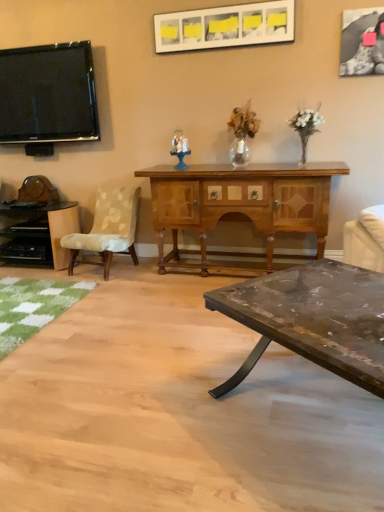
Question: Considering their positions, is rustic wood coffee table at lower right located in front of or behind translucent glass figurine at center?

Choices:
 (A) front
 (B) behind

Answer: (A)

Question: From the image's perspective, relative to translucent glass figurine at center, is rustic wood coffee table at lower right above or below?

Choices:
 (A) above
 (B) below

Answer: (B)

Question: Which is farther from the flat screen tv at upper left?

Choices:
 (A) rustic wood coffee table at lower right
 (B) wooden cabinet at center, the 2th desk viewed from the left
 (C) black glossy desk at left, the second desk in the right-to-left sequence
 (D) white fabric couch at right
 (E) beige fabric chair at left

Answer: (A)

Question: Which object is the closest to the white glossy picture frame at upper center, acting as the 1th picture frame starting from the left?

Choices:
 (A) rustic wood coffee table at lower right
 (B) flat screen tv at upper left
 (C) translucent glass figurine at center
 (D) white fabric couch at right
 (E) black textured fabric picture frame at upper right, positioned as the second picture frame in left-to-right order

Answer: (E)